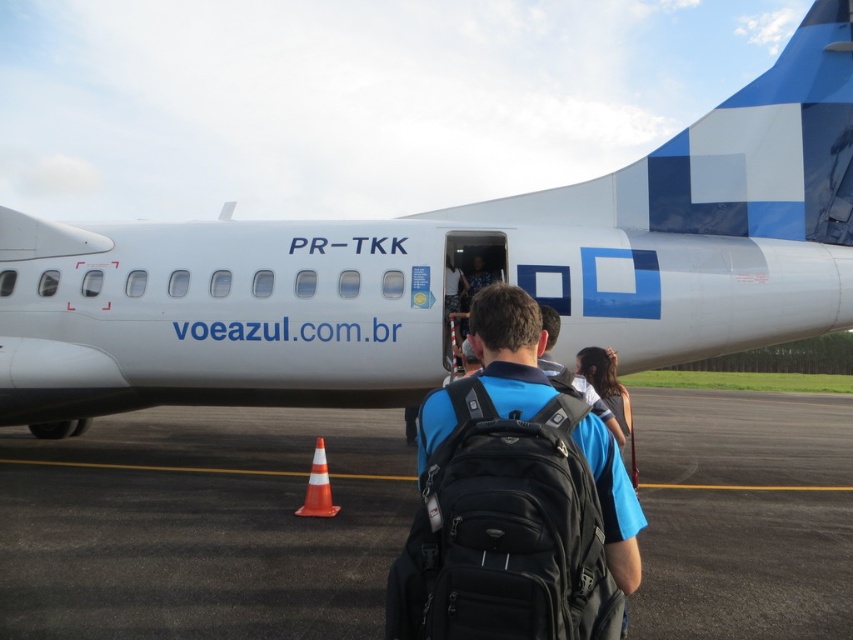
Question: Where is white matte airplane at center located in relation to black matte backpack at center in the image?

Choices:
 (A) left
 (B) right

Answer: (B)

Question: Which point is closer to the camera?

Choices:
 (A) (315, 608)
 (B) (769, 120)

Answer: (A)

Question: Is black asphalt at center bigger than black matte backpack at center?

Choices:
 (A) yes
 (B) no

Answer: (A)

Question: Which point is farther from the camera taking this photo?

Choices:
 (A) (612, 230)
 (B) (590, 477)

Answer: (A)

Question: Is black asphalt at center to the left of black matte backpack at center from the viewer's perspective?

Choices:
 (A) yes
 (B) no

Answer: (B)

Question: Among these points, which one is nearest to the camera?

Choices:
 (A) (200, 518)
 (B) (253, 400)

Answer: (A)